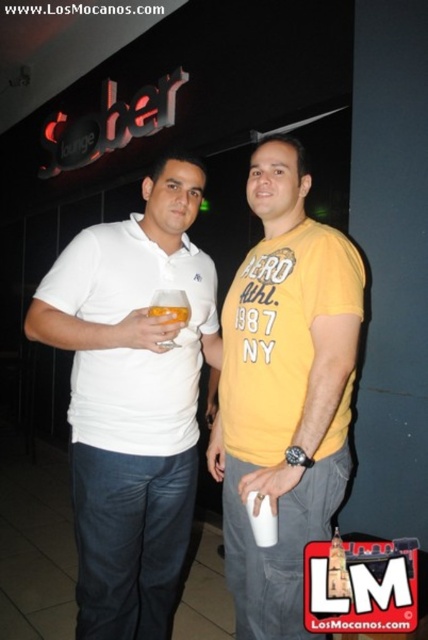
You are a photographer adjusting the camera focus. You need to ensure both the white matte polo shirt at center and the white cotton polo shirt at left are in focus. The camera has a depth of field that can cover 2.5 inches. Can both shirts be in focus?

The distance between the white matte polo shirt at center and the white cotton polo shirt at left is 2.49 inches, which is within the camera depth of field of 2.5 inches. Therefore, both shirts can be in focus.